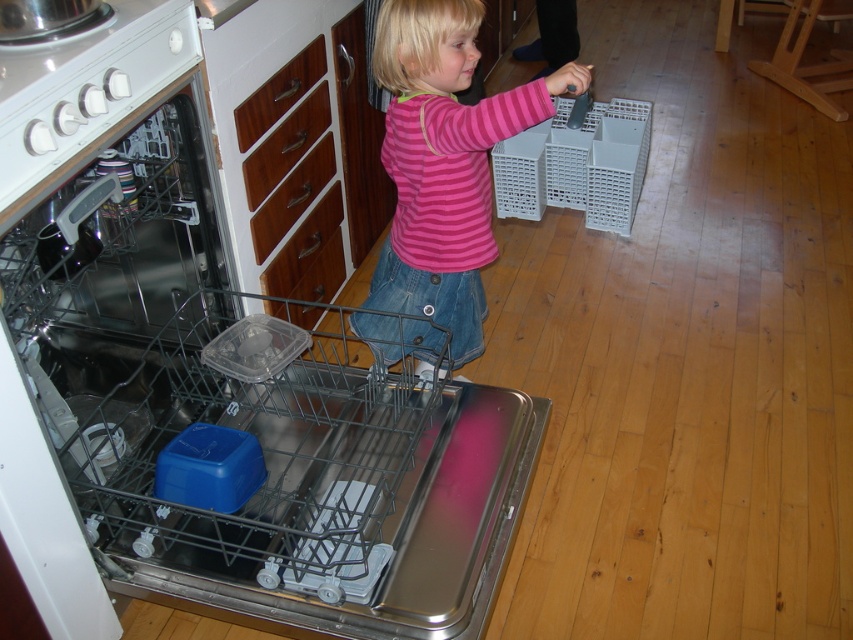
The child is trying to reach the control panel on the metallic dishwasher at center. Considering their position relative to the pink striped shirt at center, can they easily access the control panel?

The metallic dishwasher at center is closer to the viewer than the pink striped shirt at center, so the control panel, which is on the dishwasher, would be within reach if the child can extend their arm forward from their current position.

The metallic dishwasher at center has a control panel. Where is the control panel located relative to the dishwasher?

The control panel is at the top left corner of the metallic dishwasher at center.